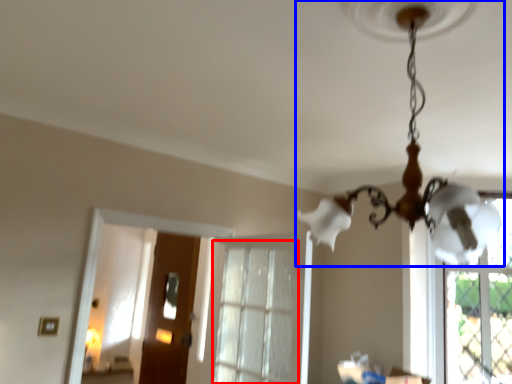
Question: Which point is closer to the camera, window (highlighted by a red box) or lamp (highlighted by a blue box)?

Choices:
 (A) window
 (B) lamp

Answer: (B)